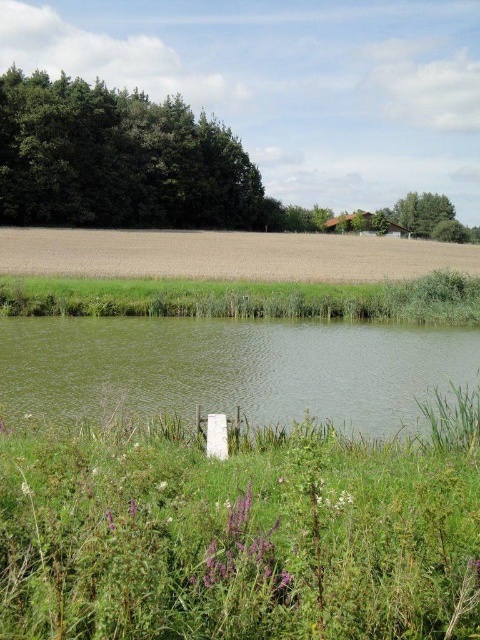
Question: Which object is closer to the camera taking this photo?

Choices:
 (A) green grassy patch at lower left
 (B) green leafy trees at upper left
 (C) brown matte field at center
 (D) green water at center

Answer: (A)

Question: Considering the relative positions of green grassy patch at lower left and brown matte field at center in the image provided, where is green grassy patch at lower left located with respect to brown matte field at center?

Choices:
 (A) below
 (B) above

Answer: (A)

Question: Which of the following is the closest to the observer?

Choices:
 (A) green water at center
 (B) green grassy patch at lower left
 (C) green leafy trees at upper left
 (D) brown matte field at center

Answer: (B)

Question: Which of the following is the farthest from the observer?

Choices:
 (A) green leafy trees at upper left
 (B) green grassy patch at lower left
 (C) brown matte field at center

Answer: (A)

Question: Does green grassy patch at lower left have a larger size compared to green water at center?

Choices:
 (A) no
 (B) yes

Answer: (A)

Question: Does green water at center appear under brown matte field at center?

Choices:
 (A) yes
 (B) no

Answer: (A)